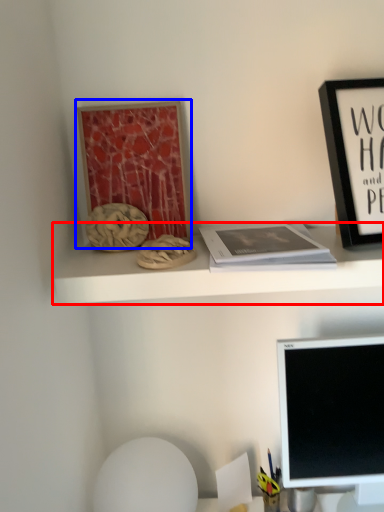
Question: Which object appears farthest to the camera in this image, shelf (highlighted by a red box) or bulletin board (highlighted by a blue box)?

Choices:
 (A) shelf
 (B) bulletin board

Answer: (B)